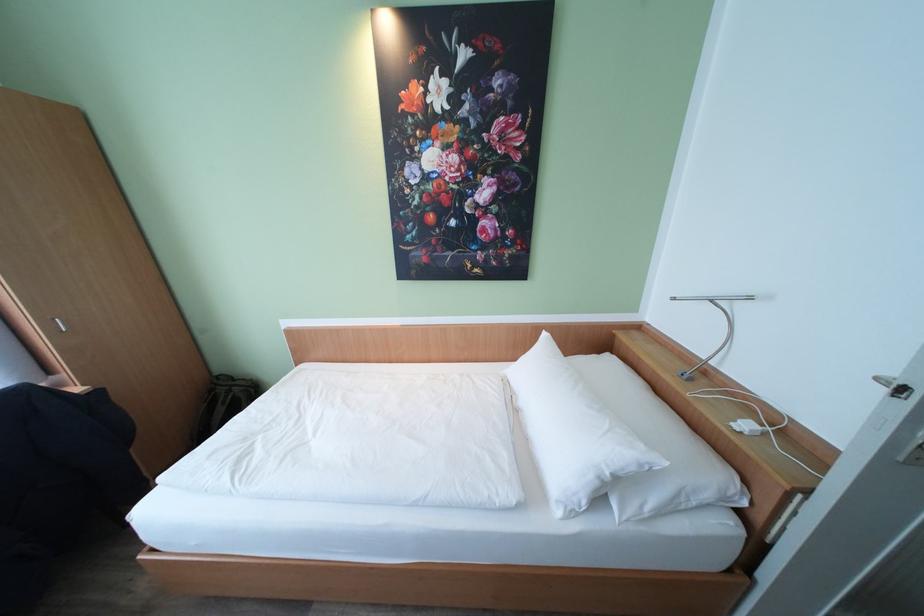
This screenshot has width=924, height=616. Describe the element at coordinates (713, 325) in the screenshot. I see `the metal lamp head` at that location.